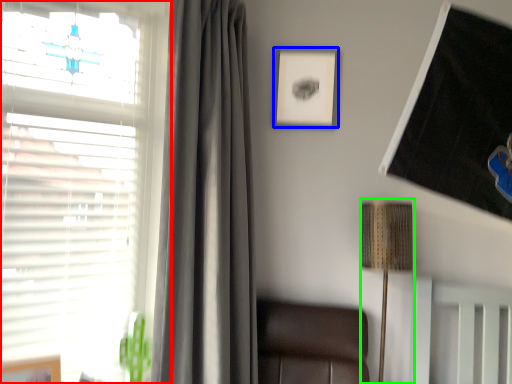
Question: Which is farther away from window (highlighted by a red box)? picture frame (highlighted by a blue box) or lamp (highlighted by a green box)?

Choices:
 (A) picture frame
 (B) lamp

Answer: (B)